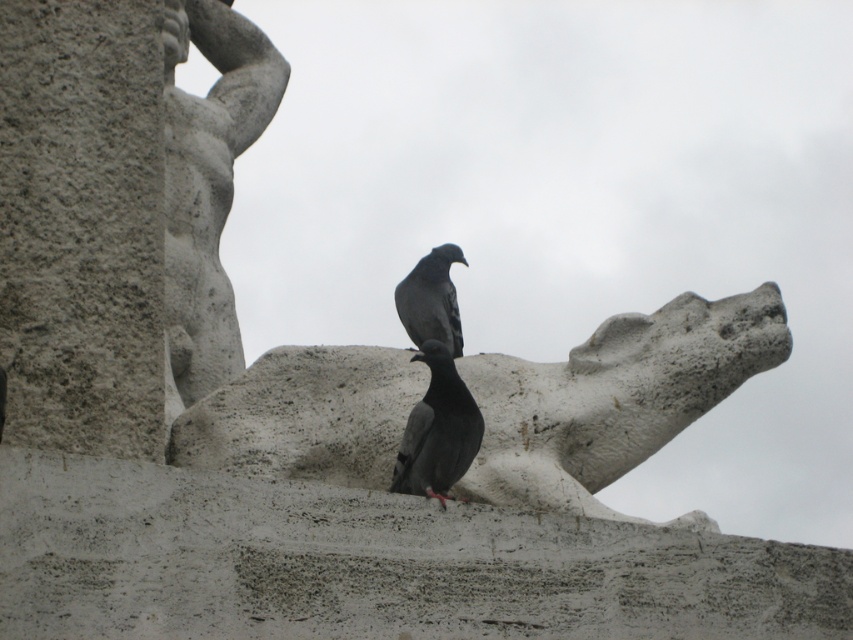
You are an art conservator examining the stone sculpture. You notice two elements, the gray stone gargoyle at center and the gray stone statue at upper left. Which of these two elements is positioned lower in the image?

The gray stone gargoyle at center is located below the gray stone statue at upper left, so it is positioned lower in the image.

You are an art student analyzing the sculpture. You notice the gray stone statue at upper left and the matte gray pigeon at center. Which object is positioned closer to your viewpoint?

The gray stone statue at upper left is closer to the viewer than the matte gray pigeon at center.

You are a photographer adjusting your camera settings to capture the two points in the image. Which point, point [45,586] or point [424,269], is nearer to your camera lens?

Point [45,586] is closer to the camera than point [424,269].